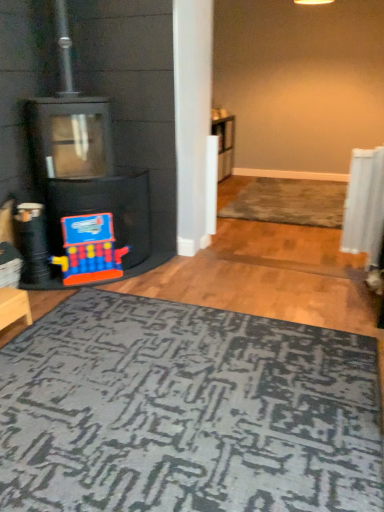
In order to face wooden stool at lower left, should I rotate leftwards or rightwards?

You should look left and rotate roughly 23.963 degrees.

Image resolution: width=384 pixels, height=512 pixels. What do you see at coordinates (187, 411) in the screenshot? I see `dark gray textured rug at lower center` at bounding box center [187, 411].

The height and width of the screenshot is (512, 384). Identify the location of wooden stool at lower left. (14, 307).

Considering the sizes of objects dark gray textured rug at lower center and rug with textured pattern at center in the image provided, who is bigger, dark gray textured rug at lower center or rug with textured pattern at center?

With larger size is rug with textured pattern at center.

Who is shorter, dark gray textured rug at lower center or rug with textured pattern at center?

dark gray textured rug at lower center.

Looking at this image, is rug with textured pattern at center at the back of dark gray textured rug at lower center?

No, dark gray textured rug at lower center's orientation is not away from rug with textured pattern at center.

Is dark gray textured rug at lower center facing towards matte plastic toy at lower left?

No, dark gray textured rug at lower center is not turned towards matte plastic toy at lower left.

Is point (244, 391) closer or farther from the camera than point (109, 247)?

Clearly, point (244, 391) is closer to the camera than point (109, 247).

From the image's perspective, which is above, dark gray textured rug at lower center or matte plastic toy at lower left?

matte plastic toy at lower left is shown above in the image.

Is dark gray textured rug at lower center with matte plastic toy at lower left?

dark gray textured rug at lower center and matte plastic toy at lower left are not in contact.

Can you confirm if matte plastic toy at lower left is thinner than wooden stool at lower left?

Correct, the width of matte plastic toy at lower left is less than that of wooden stool at lower left.

Considering the relative sizes of matte plastic toy at lower left and wooden stool at lower left in the image provided, is matte plastic toy at lower left bigger than wooden stool at lower left?

Yes.

How many degrees apart are the facing directions of matte plastic toy at lower left and wooden stool at lower left?

matte plastic toy at lower left and wooden stool at lower left are facing 50.3 degrees away from each other.

Is wooden stool at lower left at the back of matte plastic toy at lower left?

matte plastic toy at lower left is not turned away from wooden stool at lower left.

Between wooden stool at lower left and dark gray textured rug at lower center, which one appears on the right side from the viewer's perspective?

From the viewer's perspective, dark gray textured rug at lower center appears more on the right side.

From the image's perspective, relative to dark gray textured rug at lower center, is wooden stool at lower left above or below?

Clearly, from the image's perspective, wooden stool at lower left is above dark gray textured rug at lower center.

The image size is (384, 512). Find the location of `furniture lying above the dark gray textured rug at lower center (from the image's perspective)`. furniture lying above the dark gray textured rug at lower center (from the image's perspective) is located at coordinates (14, 307).

Which of these two, wooden stool at lower left or dark gray textured rug at lower center, is smaller?

Smaller between the two is wooden stool at lower left.

Can we say matte plastic toy at lower left lies outside dark gray textured rug at lower center?

Yes.

Considering the sizes of objects matte plastic toy at lower left and dark gray textured rug at lower center in the image provided, who is bigger, matte plastic toy at lower left or dark gray textured rug at lower center?

Bigger between the two is dark gray textured rug at lower center.

Is matte plastic toy at lower left far from dark gray textured rug at lower center?

matte plastic toy at lower left is positioned a significant distance from dark gray textured rug at lower center.

Does point (62, 224) come behind point (351, 351)?

That is True.

Looking at this image, based on their sizes in the image, would you say black matte fireplace at left is bigger or smaller than rug with textured pattern at center?

In the image, black matte fireplace at left appears to be larger than rug with textured pattern at center.

Identify the location of doormat below the black matte fireplace at left (from the image's perspective). This screenshot has height=512, width=384. (289, 202).

From the picture: Is rug with textured pattern at center located within black matte fireplace at left?

No, rug with textured pattern at center is not a part of black matte fireplace at left.

Which of these two, black matte fireplace at left or rug with textured pattern at center, is wider?

rug with textured pattern at center is wider.

Does wooden stool at lower left have a smaller size compared to matte plastic toy at lower left?

Yes, wooden stool at lower left is smaller than matte plastic toy at lower left.

Is wooden stool at lower left inside the boundaries of matte plastic toy at lower left, or outside?

wooden stool at lower left is not inside matte plastic toy at lower left, it's outside.

Between point (9, 316) and point (110, 225), which one is positioned in front?

Point (9, 316)

Does wooden stool at lower left turn towards matte plastic toy at lower left?

No.

Image resolution: width=384 pixels, height=512 pixels. What are the coordinates of `doormat that is above the dark gray textured rug at lower center (from the image's perspective)` in the screenshot? It's located at (289, 202).

You are a GUI agent. You are given a task and a screenshot of the screen. Output one action in this format:
    pyautogui.click(x=<x>, y=<y>)
    Task: Click on the toy behind the dark gray textured rug at lower center
    The width and height of the screenshot is (384, 512).
    Given the screenshot: What is the action you would take?
    pyautogui.click(x=89, y=249)

Looking at the image, which one is located further to wooden stool at lower left, dark gray textured rug at lower center or rug with textured pattern at center?

Among the two, rug with textured pattern at center is located further to wooden stool at lower left.

When comparing their distances from dark gray textured rug at lower center, does matte plastic toy at lower left or wooden stool at lower left seem closer?

wooden stool at lower left lies closer to dark gray textured rug at lower center than the other object.

From the image, which object appears to be nearer to matte plastic toy at lower left, wooden stool at lower left or dark gray textured rug at lower center?

Among the two, wooden stool at lower left is located nearer to matte plastic toy at lower left.

Which object lies nearer to the anchor point black matte fireplace at left, wooden stool at lower left or dark gray textured rug at lower center?

The object closer to black matte fireplace at left is wooden stool at lower left.

Based on their spatial positions, is black matte fireplace at left or dark gray textured rug at lower center closer to rug with textured pattern at center?

black matte fireplace at left.

Considering their positions, is black matte fireplace at left positioned closer to wooden stool at lower left than matte plastic toy at lower left?

matte plastic toy at lower left.

Estimate the real-world distances between objects in this image. Which object is further from rug with textured pattern at center, wooden stool at lower left or dark gray textured rug at lower center?

Among the two, wooden stool at lower left is located further to rug with textured pattern at center.

From the image, which object appears to be nearer to rug with textured pattern at center, dark gray textured rug at lower center or wooden stool at lower left?

dark gray textured rug at lower center is positioned closer to the anchor rug with textured pattern at center.

What are the coordinates of `toy between black matte fireplace at left and wooden stool at lower left vertically` in the screenshot? It's located at [89, 249].

Locate an element on the screen. The image size is (384, 512). toy between black matte fireplace at left and rug with textured pattern at center from left to right is located at coordinates (89, 249).

The height and width of the screenshot is (512, 384). Identify the location of fireplace located between dark gray textured rug at lower center and matte plastic toy at lower left in the depth direction. (84, 177).

Where is `toy between wooden stool at lower left and rug with textured pattern at center from left to right`? The width and height of the screenshot is (384, 512). toy between wooden stool at lower left and rug with textured pattern at center from left to right is located at coordinates (89, 249).